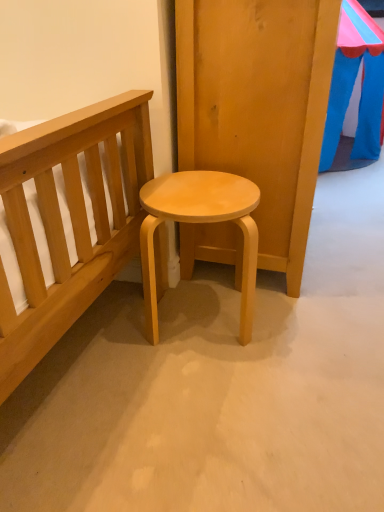
Locate an element on the screen. This screenshot has width=384, height=512. empty space that is ontop of light wood stool at center is located at coordinates (200, 190).